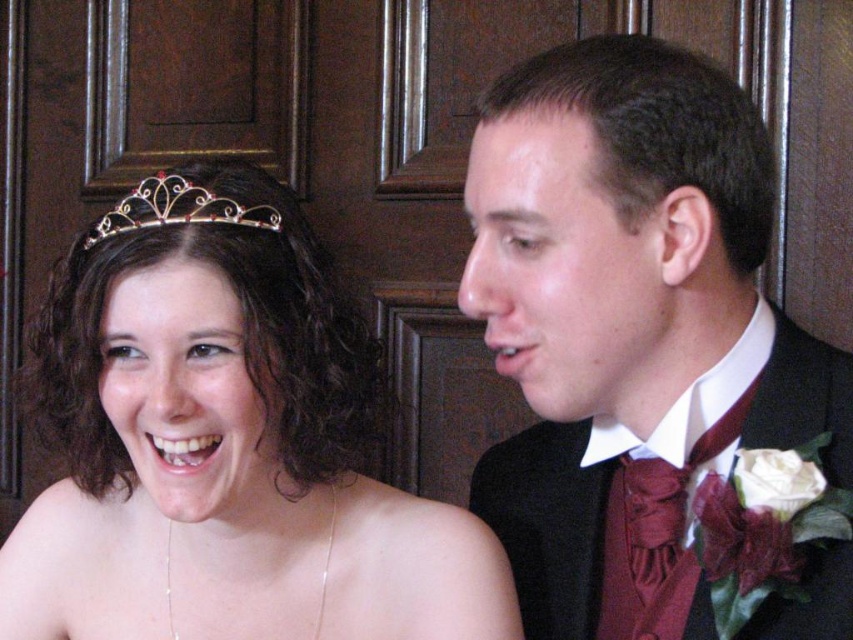
You are at a wedding reception and need to find the couple. The bride is wearing the matte gold tiara at upper left and the groom is wearing the matte black suit at right. Since the groom is to the right of the bride, which direction should you look first to spot them both?

You should look at the matte gold tiara at upper left first because the groom, wearing the matte black suit at right, is positioned to the right of the bride with the matte gold tiara at upper left.